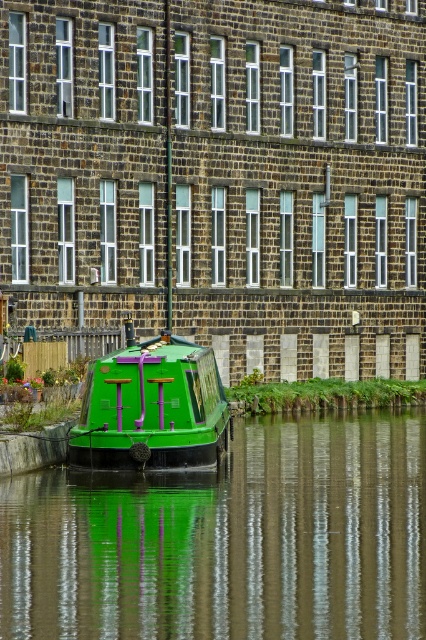
Which is above, green glossy boat at lower left or green matte boat at center?

green matte boat at center

Is the position of green glossy boat at lower left more distant than that of green matte boat at center?

No, it is not.

Identify the location of green glossy boat at lower left. (229, 540).